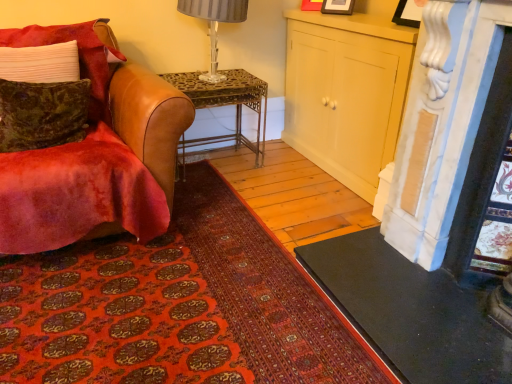
Question: Would you say velvet green pillow at left, which is the second pillow from bottom to top, is outside metallic wrought iron desk at center?

Choices:
 (A) no
 (B) yes

Answer: (B)

Question: Can you confirm if velvet green pillow at left, arranged as the first pillow when viewed from the top, is thinner than metallic wrought iron desk at center?

Choices:
 (A) yes
 (B) no

Answer: (A)

Question: Does velvet green pillow at left, arranged as the first pillow when viewed from the top, have a smaller size compared to metallic wrought iron desk at center?

Choices:
 (A) no
 (B) yes

Answer: (B)

Question: From a real-world perspective, does velvet green pillow at left, which is the second pillow from bottom to top, sit lower than metallic wrought iron desk at center?

Choices:
 (A) no
 (B) yes

Answer: (A)

Question: From the image's perspective, is velvet green pillow at left, which is the second pillow from bottom to top, below metallic wrought iron desk at center?

Choices:
 (A) yes
 (B) no

Answer: (B)

Question: In terms of width, does velvet brown leather chair at left look wider or thinner when compared to metallic silver lamp at upper center?

Choices:
 (A) thin
 (B) wide

Answer: (B)

Question: Looking at the image, does velvet brown leather chair at left seem bigger or smaller compared to metallic silver lamp at upper center?

Choices:
 (A) big
 (B) small

Answer: (A)

Question: Is point (53, 180) positioned closer to the camera than point (215, 61)?

Choices:
 (A) closer
 (B) farther

Answer: (A)

Question: Is velvet brown leather chair at left to the left or to the right of metallic silver lamp at upper center in the image?

Choices:
 (A) right
 (B) left

Answer: (B)

Question: Which is correct: velvet green pillow at left, which is the second pillow from bottom to top, is inside matte cream cabinet at center, or outside of it?

Choices:
 (A) inside
 (B) outside

Answer: (B)

Question: Relative to matte cream cabinet at center, is velvet green pillow at left, which is the second pillow from bottom to top, in front or behind?

Choices:
 (A) behind
 (B) front

Answer: (B)

Question: Looking at the image, does velvet green pillow at left, which is the second pillow from bottom to top, seem bigger or smaller compared to matte cream cabinet at center?

Choices:
 (A) big
 (B) small

Answer: (B)

Question: In terms of width, does velvet green pillow at left, arranged as the first pillow when viewed from the top, look wider or thinner when compared to matte cream cabinet at center?

Choices:
 (A) thin
 (B) wide

Answer: (A)

Question: Considering their positions, is matte cream cabinet at center located in front of or behind velvet green pillow at left, which ranks as the 1th pillow in bottom-to-top order?

Choices:
 (A) front
 (B) behind

Answer: (B)

Question: Looking at the image, does matte cream cabinet at center seem bigger or smaller compared to velvet green pillow at left, which ranks as the 1th pillow in bottom-to-top order?

Choices:
 (A) big
 (B) small

Answer: (A)